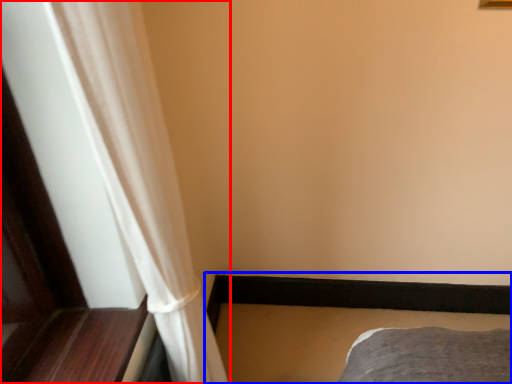
Question: Which object appears closest to the camera in this image, curtain (highlighted by a red box) or bed frame (highlighted by a blue box)?

Choices:
 (A) curtain
 (B) bed frame

Answer: (A)